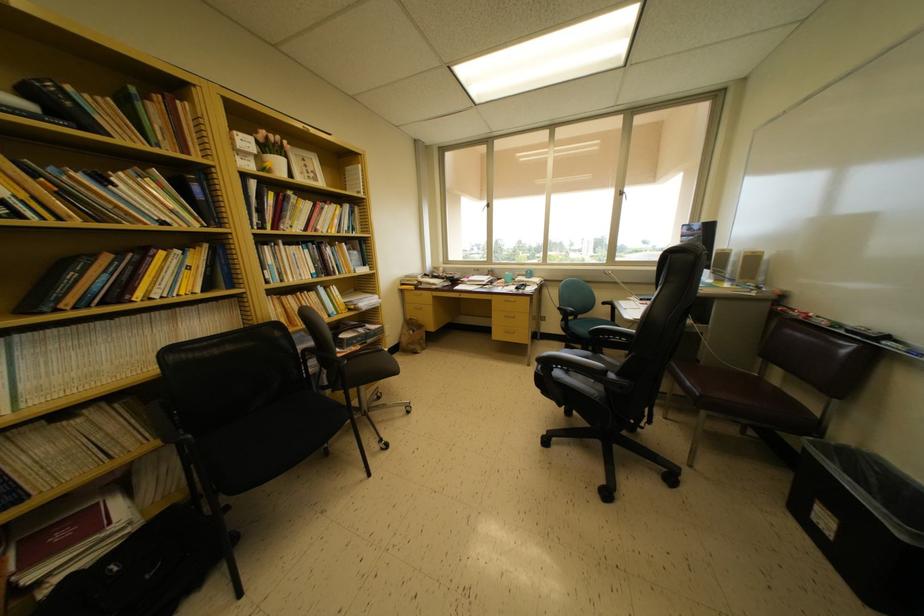
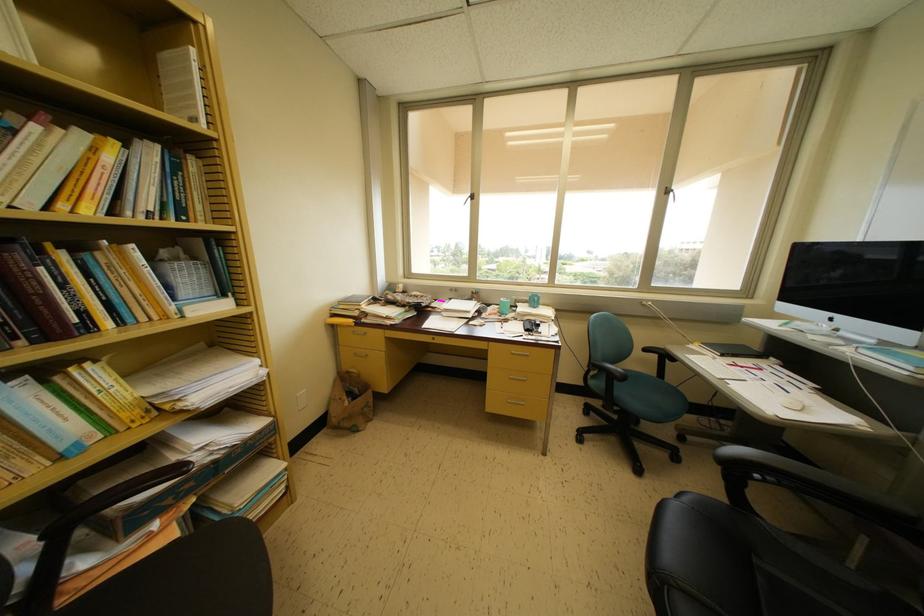
In the second image, find the point that corresponds to point (363, 171) in the first image.

(197, 55)